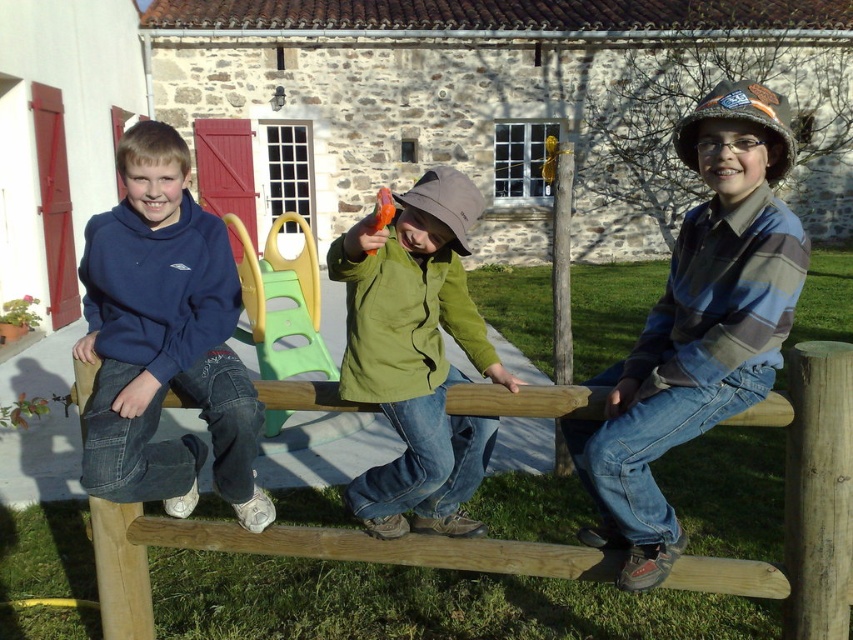
You are a parent trying to ensure the seesaw is balanced. The wooden at center and the green matte jacket at center are both on the seesaw. Which object is lower to the ground?

The wooden at center has a lesser height compared to green matte jacket at center, so the wooden at center is lower to the ground.

You are planning to set up a new play area and need to know the space requirements. Based on the image, which object is wider, the wooden at center or the green plastic slide at center?

The wooden at center is wider than the green plastic slide at center according to the description.

You are a photographer trying to capture a closeup of the seesaw. You have two points marked on your viewfinder at coordinates point (x=680, y=561) and point (x=271, y=426). Which point should you focus on to get the closest subject in your shot?

Point (x=680, y=561) is closer to the viewer than point (x=271, y=426), so focusing on point (x=680, y=561) will capture the closest subject in your shot.